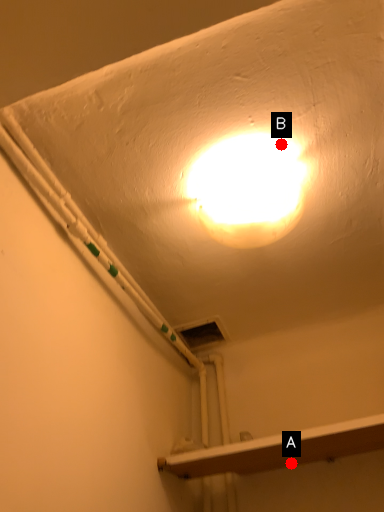
Question: Two points are circled on the image, labeled by A and B beside each circle. Which point is farther from the camera taking this photo?

Choices:
 (A) A is further
 (B) B is further

Answer: (A)